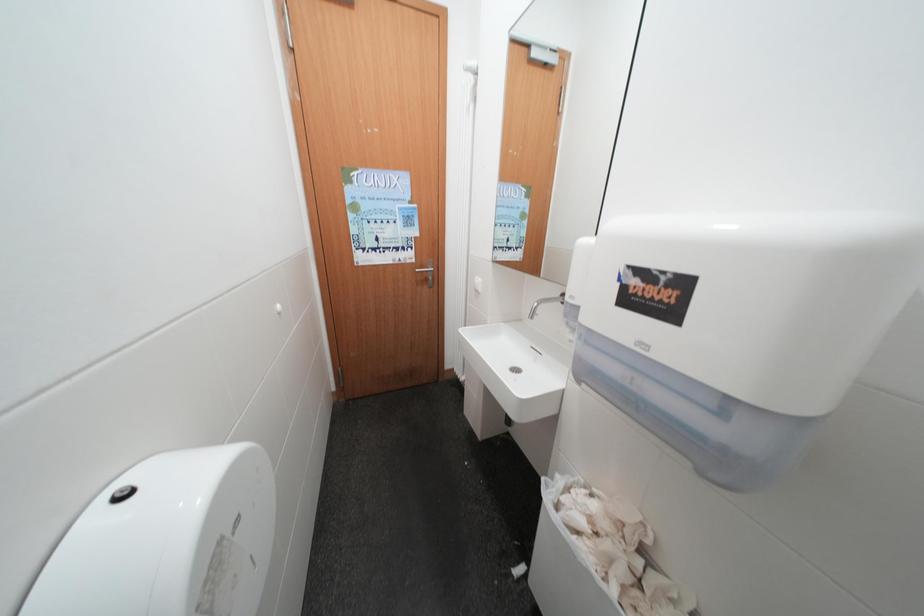
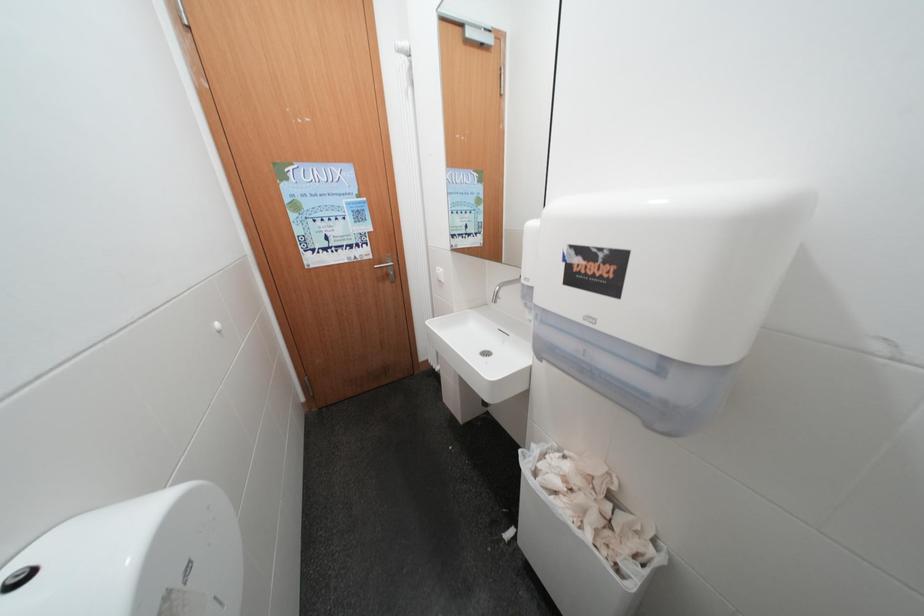
Question: The first image is from the beginning of the video and the second image is from the end. How did the camera likely rotate when shooting the video?

Choices:
 (A) Left
 (B) Right
 (C) Up
 (D) Down

Answer: (B)